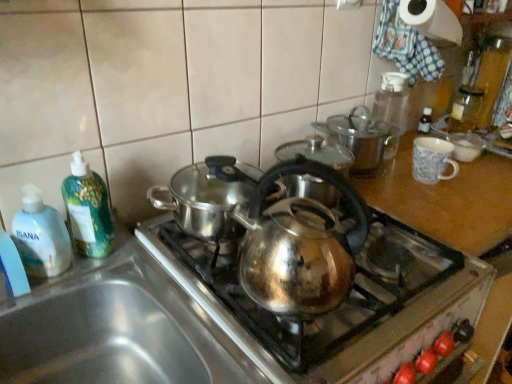
Question: Is transparent glass bottle at upper right, arranged as the first bottle when viewed from the back, facing towards green plastic bottle at left, which is the second bottle from front to back?

Choices:
 (A) no
 (B) yes

Answer: (A)

Question: From the image's perspective, is transparent glass bottle at upper right, arranged as the first bottle when viewed from the back, above green plastic bottle at left, arranged as the second bottle when viewed from the left?

Choices:
 (A) no
 (B) yes

Answer: (B)

Question: From a real-world perspective, is transparent glass bottle at upper right, the 1th bottle in the right-to-left sequence, on top of green plastic bottle at left, which is the second bottle from front to back?

Choices:
 (A) yes
 (B) no

Answer: (B)

Question: Is transparent glass bottle at upper right, which is the 4th bottle in left-to-right order, shorter than green plastic bottle at left, arranged as the second bottle when viewed from the left?

Choices:
 (A) yes
 (B) no

Answer: (A)

Question: Are transparent glass bottle at upper right, the 1th bottle in the right-to-left sequence, and green plastic bottle at left, arranged as the second bottle when viewed from the left, far apart?

Choices:
 (A) yes
 (B) no

Answer: (A)

Question: Is transparent glass bottle at upper right, which is the 4th bottle in left-to-right order, wider than green plastic bottle at left, arranged as the second bottle when viewed from the left?

Choices:
 (A) yes
 (B) no

Answer: (A)

Question: Considering the relative positions of translucent plastic soap dispenser at left, the first bottle when ordered from left to right, and white paper towel at upper right in the image provided, is translucent plastic soap dispenser at left, the first bottle when ordered from left to right, in front of white paper towel at upper right?

Choices:
 (A) no
 (B) yes

Answer: (B)

Question: From a real-world perspective, does translucent plastic soap dispenser at left, the first bottle when ordered from left to right, sit lower than white paper towel at upper right?

Choices:
 (A) yes
 (B) no

Answer: (A)

Question: From a real-world perspective, is translucent plastic soap dispenser at left, the fourth bottle from the right, located higher than white paper towel at upper right?

Choices:
 (A) no
 (B) yes

Answer: (A)

Question: Is translucent plastic soap dispenser at left, the first bottle when ordered from left to right, further to the viewer compared to white paper towel at upper right?

Choices:
 (A) no
 (B) yes

Answer: (A)

Question: Is translucent plastic soap dispenser at left, the fourth bottle from the right, not inside white paper towel at upper right?

Choices:
 (A) yes
 (B) no

Answer: (A)

Question: Is translucent plastic soap dispenser at left, the fourth bottle from the right, next to white paper towel at upper right?

Choices:
 (A) yes
 (B) no

Answer: (B)

Question: Is transparent glass bottle at upper right, which appears as the fourth bottle when viewed from the front, a part of shiny metallic kettle at center?

Choices:
 (A) yes
 (B) no

Answer: (B)